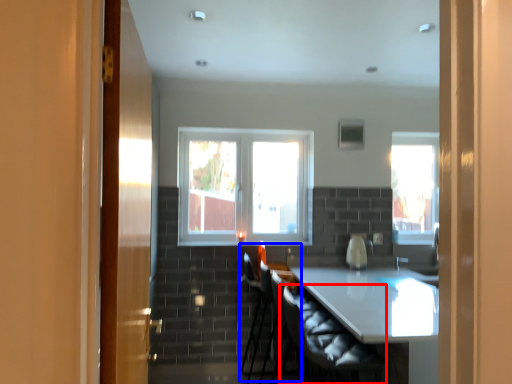
Question: Which of the following is the closest to the observer, swivel chair (highlighted by a red box) or armchair (highlighted by a blue box)?

Choices:
 (A) swivel chair
 (B) armchair

Answer: (A)